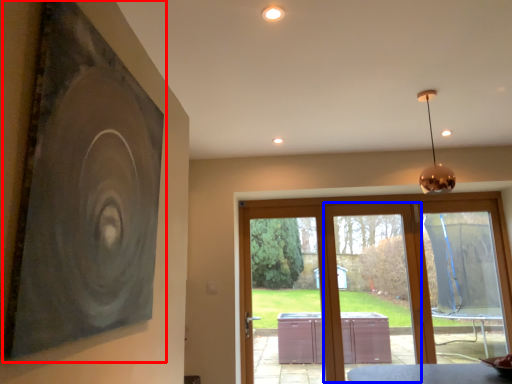
Question: Which object is further to the camera taking this photo, picture frame (highlighted by a red box) or screen door (highlighted by a blue box)?

Choices:
 (A) picture frame
 (B) screen door

Answer: (B)